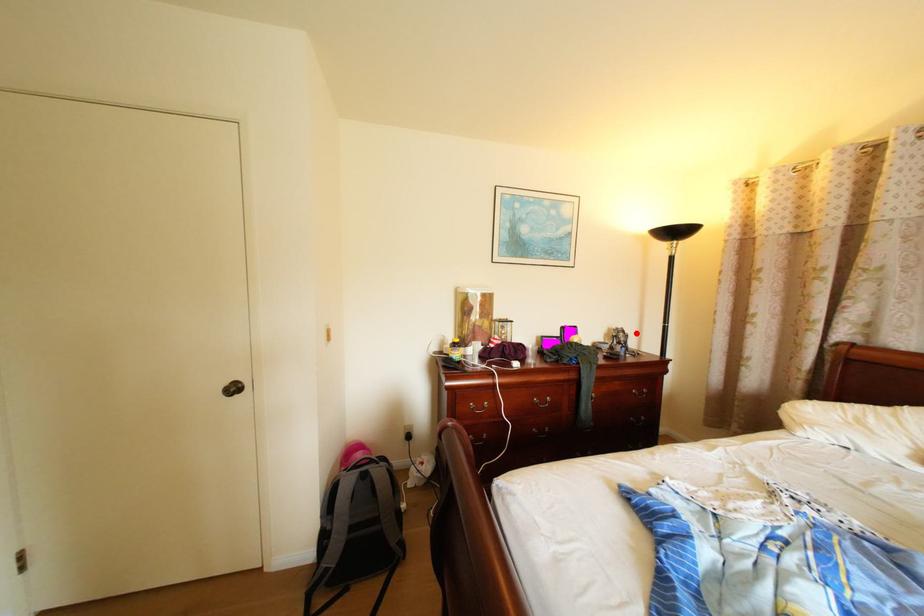
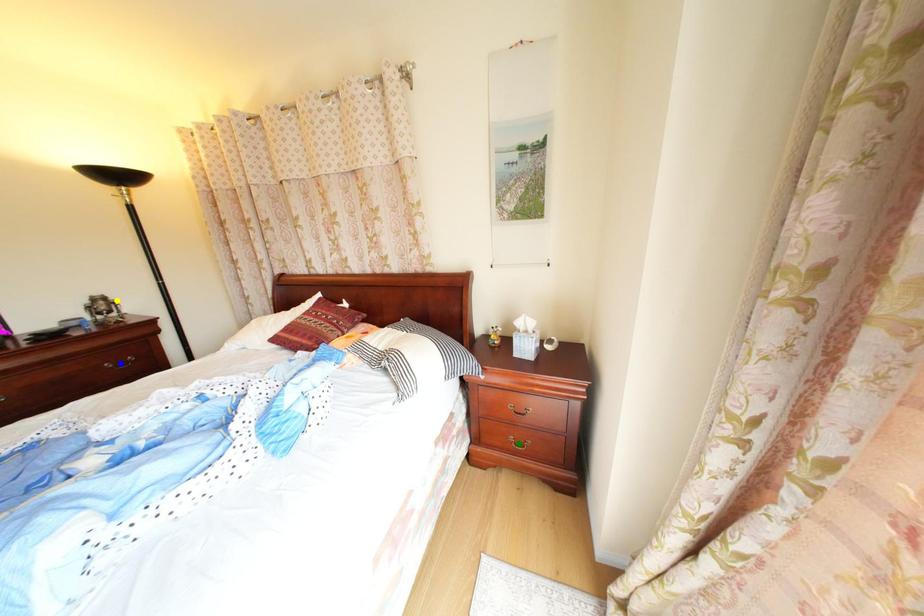
Question: I am providing you with two images of the same scene from different viewpoints. A red point is marked on the first image. You are given multiple points on the second image. Which spot in image 2 lines up with the point in image 1?

Choices:
 (A) yellow point
 (B) green point
 (C) blue point

Answer: (A)